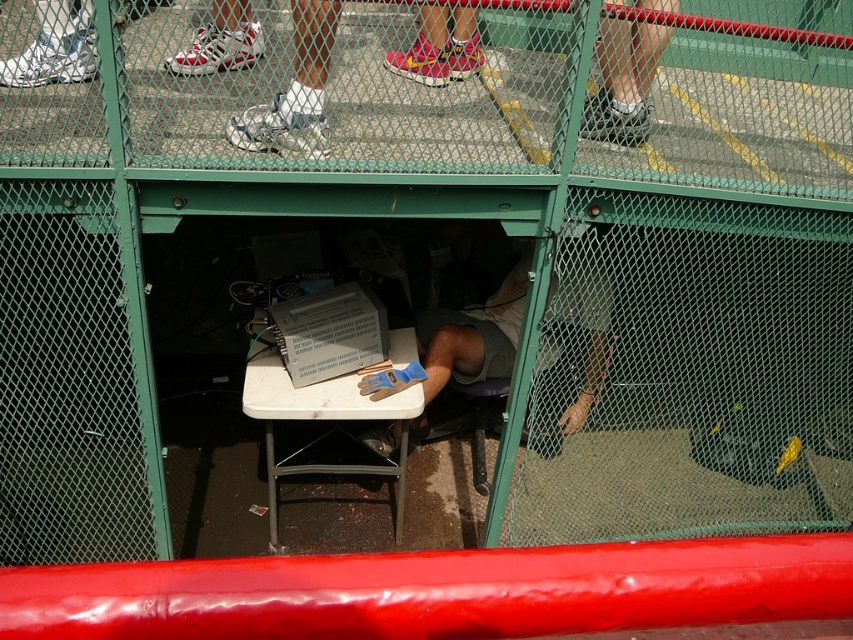
You are a spectator at the stadium and you see the gray fabric shirt at center and the white plastic table at center. Which object is positioned higher from the ground?

The gray fabric shirt at center is located above the white plastic table at center, so it is higher from the ground.